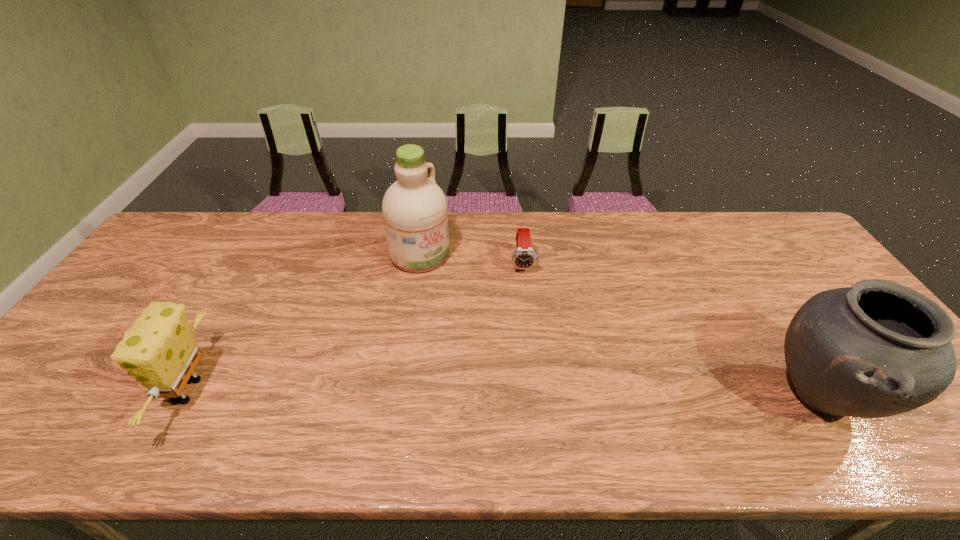
What are the coordinates of `sponge present at the near edge` in the screenshot? It's located at (159, 350).

Where is `urn present at the near edge`? This screenshot has height=540, width=960. urn present at the near edge is located at coordinates (876, 349).

I want to click on object located in the right edge section of the desktop, so click(x=876, y=349).

Where is `object situated at the near right corner`? Image resolution: width=960 pixels, height=540 pixels. object situated at the near right corner is located at coordinates (876, 349).

The height and width of the screenshot is (540, 960). Find the location of `free region at the far edge of the desktop`. free region at the far edge of the desktop is located at coordinates (387, 251).

Where is `vacant space at the near edge of the desktop`? The height and width of the screenshot is (540, 960). vacant space at the near edge of the desktop is located at coordinates (454, 411).

This screenshot has height=540, width=960. In the image, there is a desktop. What are the coordinates of `free space at the left edge` in the screenshot? It's located at (161, 259).

In the image, there is a desktop. Where is `free space at the right edge`? The height and width of the screenshot is (540, 960). free space at the right edge is located at coordinates (789, 275).

This screenshot has height=540, width=960. In the image, there is a desktop. Identify the location of vacant space at the far right corner. (745, 213).

Where is `free spot between the watch and the sponge`? free spot between the watch and the sponge is located at coordinates (356, 327).